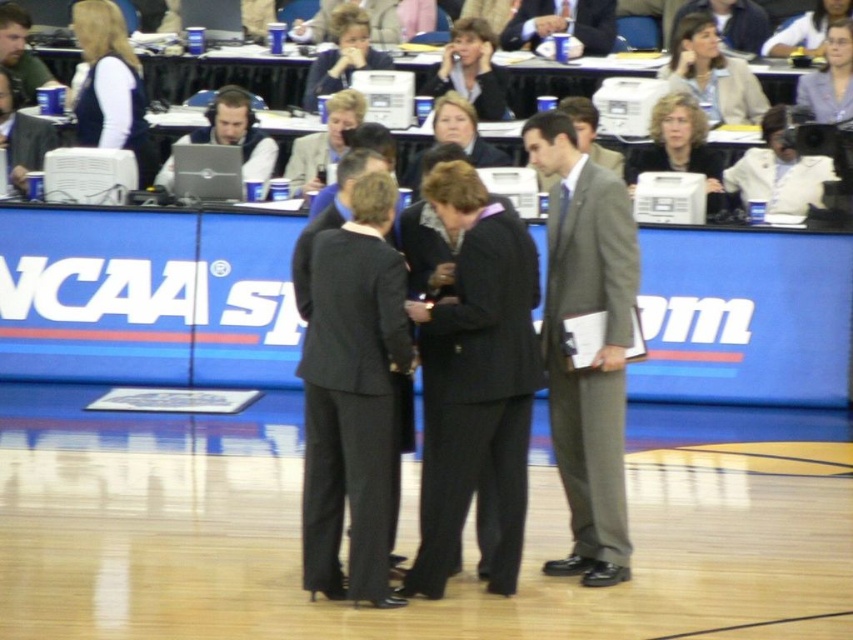
Can you confirm if black pinstripe suit at center is taller than matte black laptop at upper left?

Yes, black pinstripe suit at center is taller than matte black laptop at upper left.

Which is above, black pinstripe suit at center or matte black laptop at upper left?

matte black laptop at upper left is higher up.

Find the location of a particular element. Image resolution: width=853 pixels, height=640 pixels. black pinstripe suit at center is located at coordinates (479, 406).

The image size is (853, 640). Describe the element at coordinates (351, 410) in the screenshot. I see `dark gray wool suit at center` at that location.

Between point (321, 573) and point (213, 138), which one is positioned in front?

Positioned in front is point (321, 573).

You are a GUI agent. You are given a task and a screenshot of the screen. Output one action in this format:
    pyautogui.click(x=<x>, y=<y>)
    Task: Click on the dark gray wool suit at center
    This screenshot has height=640, width=853.
    Given the screenshot: What is the action you would take?
    pyautogui.click(x=351, y=410)

Between dark gray suit at center and dark gray wool suit at center, which one is positioned higher?

dark gray suit at center is higher up.

Which is behind, point (438, 509) or point (328, 280)?

The point (438, 509) is behind.

Which is in front, point (492, 372) or point (338, 492)?

Point (492, 372) is in front.

Where is `dark gray suit at center`? The image size is (853, 640). dark gray suit at center is located at coordinates (476, 388).